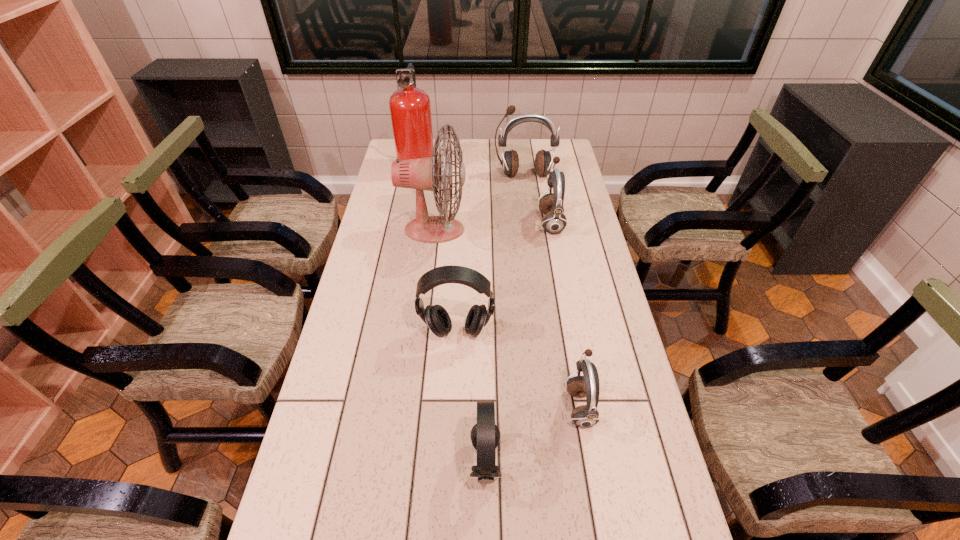
Point out which earphone is positioned as the fourth nearest to the fire extinguisher. Please provide its 2D coordinates. Your answer should be formatted as a tuple, i.e. [(x, y)], where the tuple contains the x and y coordinates of a point satisfying the conditions above.

[(584, 416)]

The height and width of the screenshot is (540, 960). In order to click on brown earphone that stands as the third closest to the third nearest object in this screenshot , I will do `click(510, 163)`.

Where is `brown earphone that stands as the closest to the second farthest brown earphone`? The height and width of the screenshot is (540, 960). brown earphone that stands as the closest to the second farthest brown earphone is located at coordinates (510, 163).